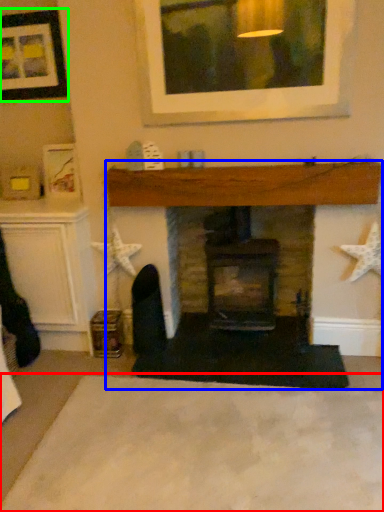
Question: Which is farther away from plain (highlighted by a red box)? fireplace (highlighted by a blue box) or picture frame (highlighted by a green box)?

Choices:
 (A) fireplace
 (B) picture frame

Answer: (B)